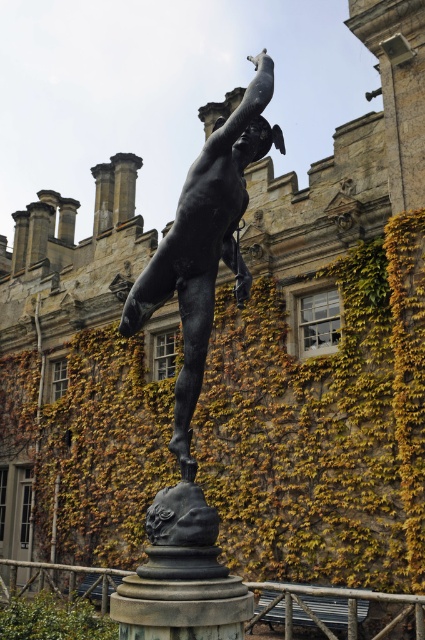
You are a gardener trying to prune the green ivy at center. You notice the bronze statue at center nearby. Can you safely trim the ivy without touching the statue?

The bronze statue at center is behind the green ivy at center, so you can safely trim the ivy without touching the statue.

You are a gardener who wants to trim the green ivy at center without damaging the bronze statue at center. Which direction should you approach from?

The green ivy at center is positioned on the left side of bronze statue at center, so you should approach from the right side to avoid damaging the statue.